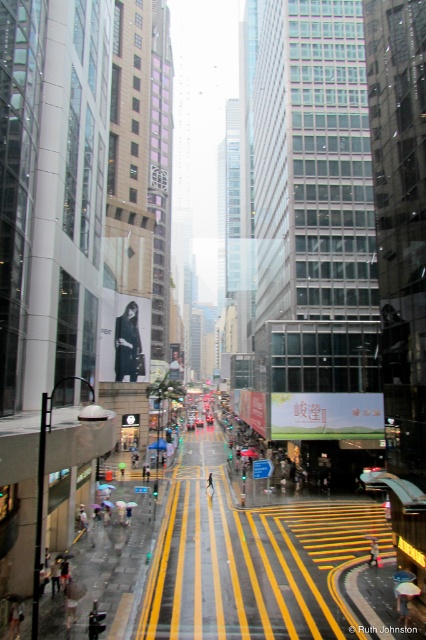
Question: Which point is closer to the camera taking this photo?

Choices:
 (A) (370, 552)
 (B) (138, 314)

Answer: (A)

Question: Among these objects, which one is farthest from the camera?

Choices:
 (A) raincoat fabric person at center
 (B) dark fabric coat at center

Answer: (B)

Question: Which point is farther from the camera taking this photo?

Choices:
 (A) (135, 376)
 (B) (377, 554)

Answer: (A)

Question: Is dark fabric coat at center to the right of raincoat fabric person at center from the viewer's perspective?

Choices:
 (A) no
 (B) yes

Answer: (A)

Question: Considering the relative positions of dark fabric coat at center and raincoat fabric person at center in the image provided, where is dark fabric coat at center located with respect to raincoat fabric person at center?

Choices:
 (A) below
 (B) above

Answer: (B)

Question: Does dark fabric coat at center have a greater width compared to raincoat fabric person at center?

Choices:
 (A) no
 (B) yes

Answer: (B)